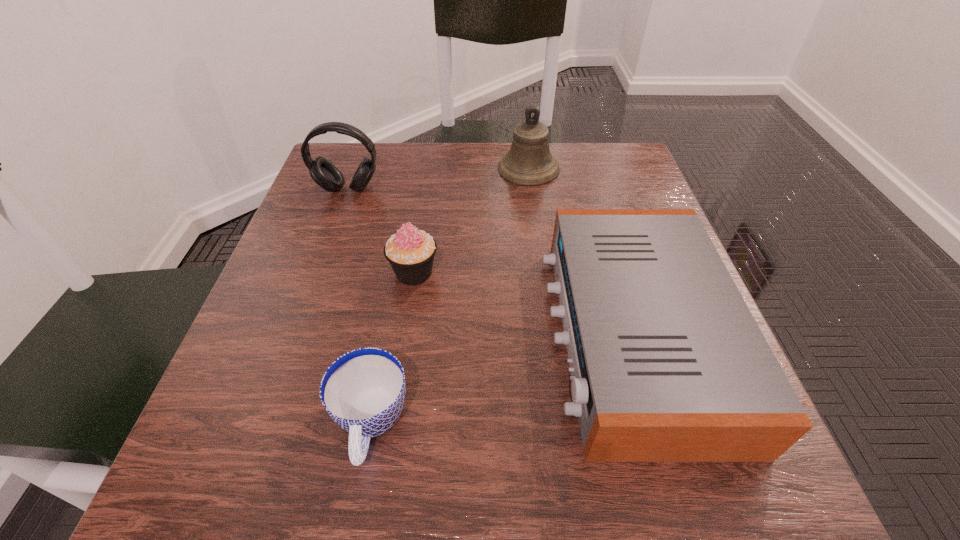
This screenshot has width=960, height=540. I want to click on vacant area at the left edge of the desktop, so click(x=315, y=402).

Identify the location of vacant region at the right edge. (632, 204).

This screenshot has height=540, width=960. Find the location of `vacant space at the far left corner of the desktop`. vacant space at the far left corner of the desktop is located at coordinates (343, 147).

At what (x,y) coordinates should I click in order to perform the action: click on blank space at the far right corner. Please return your answer as a coordinate pair (x, y). This screenshot has width=960, height=540. Looking at the image, I should click on (616, 177).

This screenshot has height=540, width=960. I want to click on vacant space that's between the bell and the cupcake, so click(x=471, y=220).

The image size is (960, 540). Identify the location of vacant area that lies between the headset and the second shortest object. (491, 262).

The width and height of the screenshot is (960, 540). Find the location of `free space between the cup and the cupcake`. free space between the cup and the cupcake is located at coordinates (393, 349).

Where is `free spot between the radio receiver and the cupcake`? The height and width of the screenshot is (540, 960). free spot between the radio receiver and the cupcake is located at coordinates (524, 304).

Where is `unoccupied position between the shortest object and the cupcake`? unoccupied position between the shortest object and the cupcake is located at coordinates tap(393, 349).

The image size is (960, 540). I want to click on free space between the leftmost object and the radio receiver, so click(x=491, y=262).